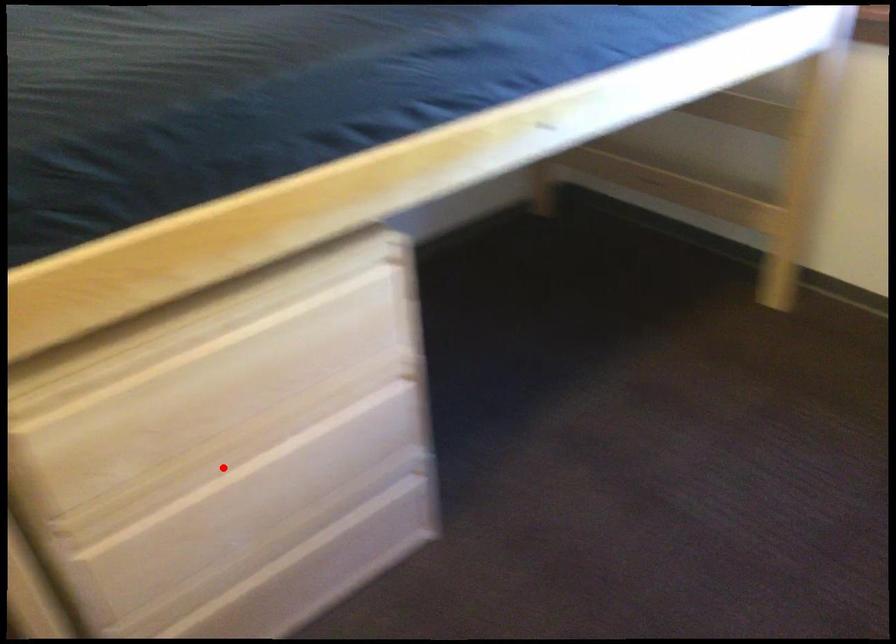
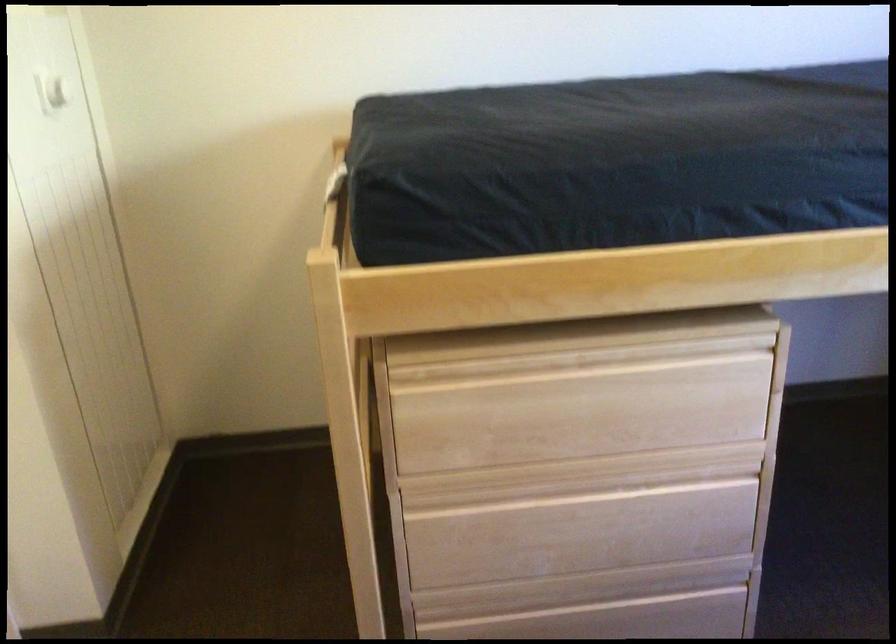
The point at the highlighted location is marked in the first image. Where is the corresponding point in the second image?

(546, 491)